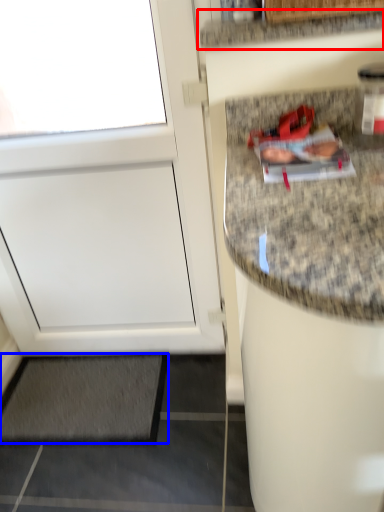
Question: Among these objects, which one is farthest to the camera, countertop (highlighted by a red box) or mat (highlighted by a blue box)?

Choices:
 (A) countertop
 (B) mat

Answer: (B)